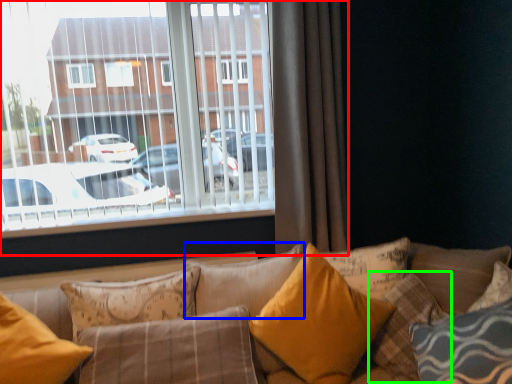
Question: Which object is positioned closest to window (highlighted by a red box)? Select from pillow (highlighted by a blue box) and pillow (highlighted by a green box).

Choices:
 (A) pillow
 (B) pillow

Answer: (A)